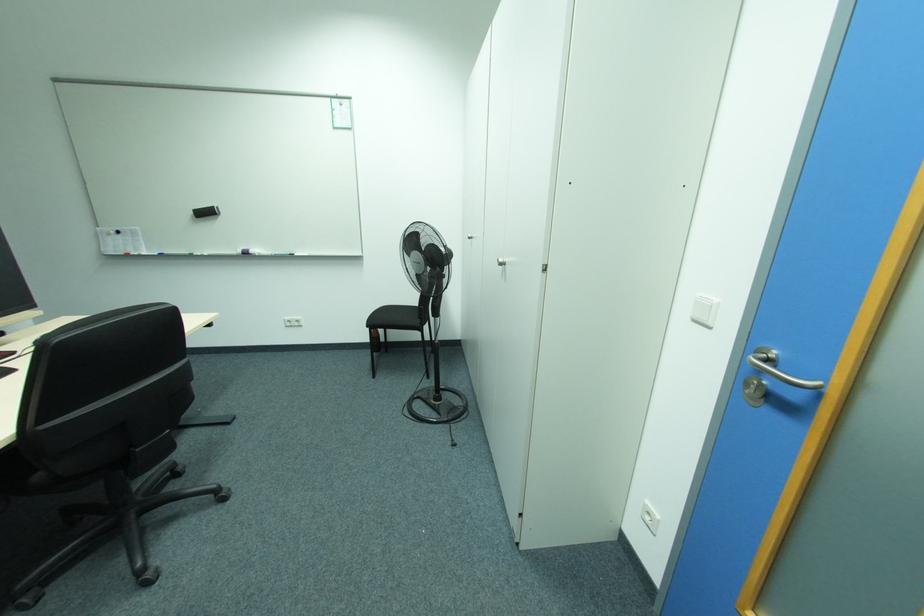
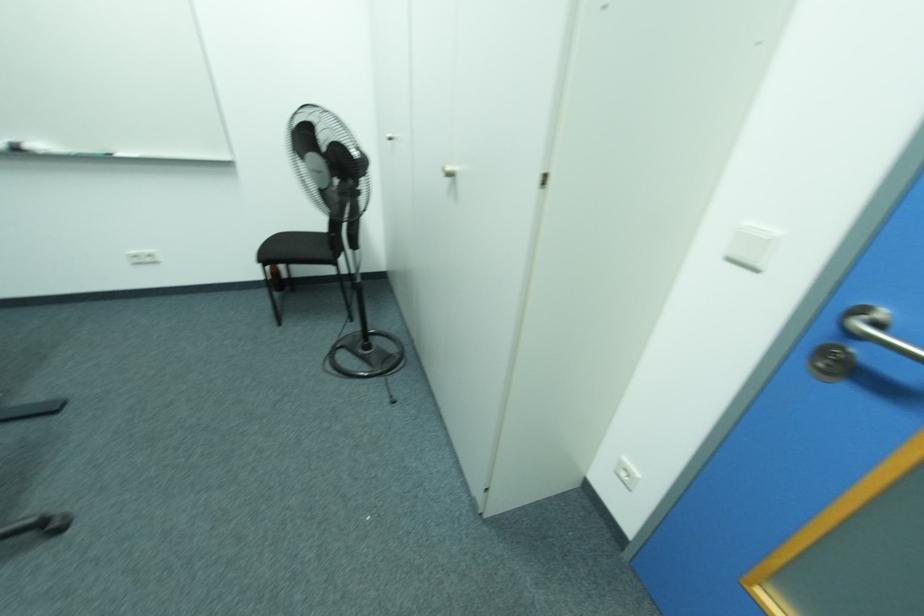
Question: Based on the continuous images, in which direction is the camera rotating? Reply with the corresponding letter.

Choices:
 (A) Left
 (B) Right
 (C) Up
 (D) Down

Answer: (D)